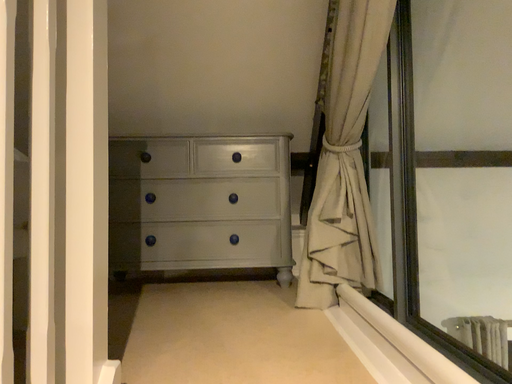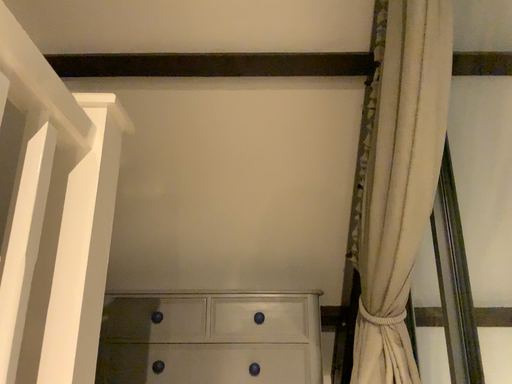
Question: How did the camera likely rotate when shooting the video?

Choices:
 (A) rotated downward
 (B) rotated upward

Answer: (B)